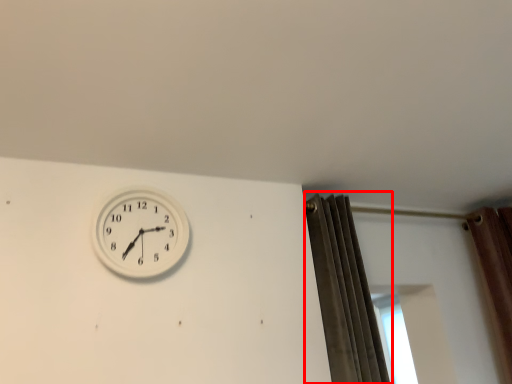
Question: From the image, what is the correct spatial relationship of curtain (annotated by the red box) in relation to wall clock?

Choices:
 (A) left
 (B) right

Answer: (B)